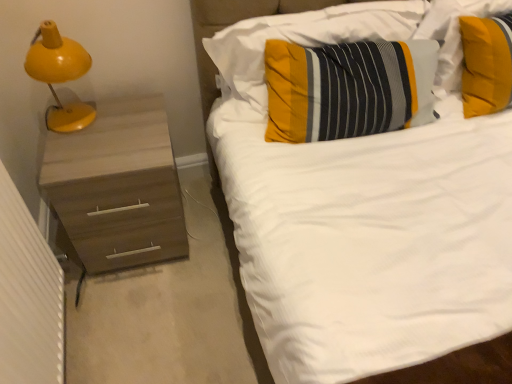
Question: From a real-world perspective, is textured yellow pillow at center, the 2th pillow when ordered from right to left, physically below striped fabric pillow at upper right, which ranks as the 3th pillow in left-to-right order?

Choices:
 (A) yes
 (B) no

Answer: (A)

Question: Is textured yellow pillow at center, which is the second pillow in left-to-right order, further to camera compared to striped fabric pillow at upper right, which ranks as the 3th pillow in left-to-right order?

Choices:
 (A) yes
 (B) no

Answer: (B)

Question: Does textured yellow pillow at center, the 2th pillow when ordered from right to left, have a lesser height compared to striped fabric pillow at upper right, arranged as the first pillow when viewed from the right?

Choices:
 (A) yes
 (B) no

Answer: (A)

Question: Is textured yellow pillow at center, which is the second pillow in left-to-right order, at the left side of striped fabric pillow at upper right, arranged as the first pillow when viewed from the right?

Choices:
 (A) no
 (B) yes

Answer: (B)

Question: Does textured yellow pillow at center, which is the second pillow in left-to-right order, appear on the right side of striped fabric pillow at upper right, arranged as the first pillow when viewed from the right?

Choices:
 (A) no
 (B) yes

Answer: (A)

Question: Can you confirm if textured yellow pillow at center, which is the second pillow in left-to-right order, is wider than striped fabric pillow at upper right, arranged as the first pillow when viewed from the right?

Choices:
 (A) yes
 (B) no

Answer: (A)

Question: Is striped fabric pillow at center, the third pillow viewed from the right, outside textured yellow pillow at center, which is the second pillow in left-to-right order?

Choices:
 (A) yes
 (B) no

Answer: (A)

Question: Is the depth of striped fabric pillow at center, the third pillow viewed from the right, less than that of textured yellow pillow at center, the 2th pillow when ordered from right to left?

Choices:
 (A) yes
 (B) no

Answer: (B)

Question: Can you confirm if striped fabric pillow at center, the third pillow viewed from the right, is thinner than textured yellow pillow at center, the 2th pillow when ordered from right to left?

Choices:
 (A) no
 (B) yes

Answer: (B)

Question: From the image's perspective, is striped fabric pillow at center, the third pillow viewed from the right, over textured yellow pillow at center, which is the second pillow in left-to-right order?

Choices:
 (A) yes
 (B) no

Answer: (A)

Question: Considering the relative positions of striped fabric pillow at center, the third pillow viewed from the right, and textured yellow pillow at center, which is the second pillow in left-to-right order, in the image provided, is striped fabric pillow at center, the third pillow viewed from the right, behind textured yellow pillow at center, which is the second pillow in left-to-right order,?

Choices:
 (A) yes
 (B) no

Answer: (A)

Question: From a real-world perspective, is striped fabric pillow at center, the third pillow viewed from the right, below textured yellow pillow at center, the 2th pillow when ordered from right to left?

Choices:
 (A) no
 (B) yes

Answer: (A)

Question: Considering the relative sizes of striped fabric pillow at upper right, arranged as the first pillow when viewed from the right, and striped fabric pillow at center, the first pillow in the left-to-right sequence, in the image provided, is striped fabric pillow at upper right, arranged as the first pillow when viewed from the right, wider than striped fabric pillow at center, the first pillow in the left-to-right sequence,?

Choices:
 (A) yes
 (B) no

Answer: (A)